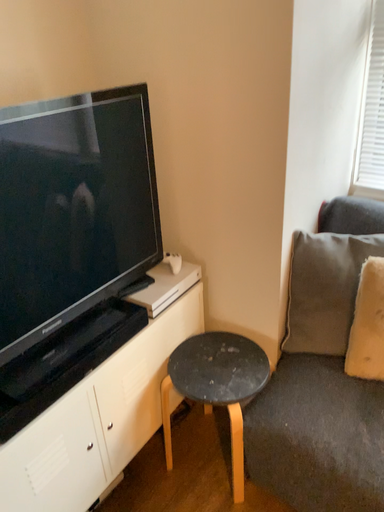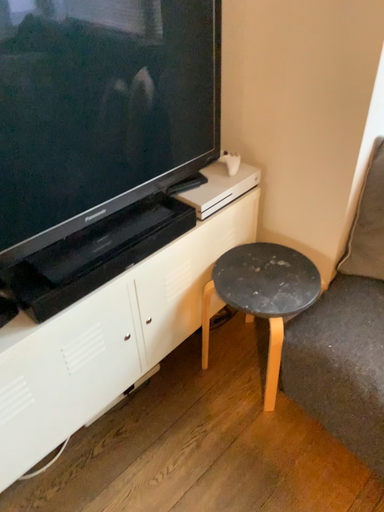
Question: Which way did the camera rotate in the video?

Choices:
 (A) rotated right
 (B) rotated left

Answer: (B)